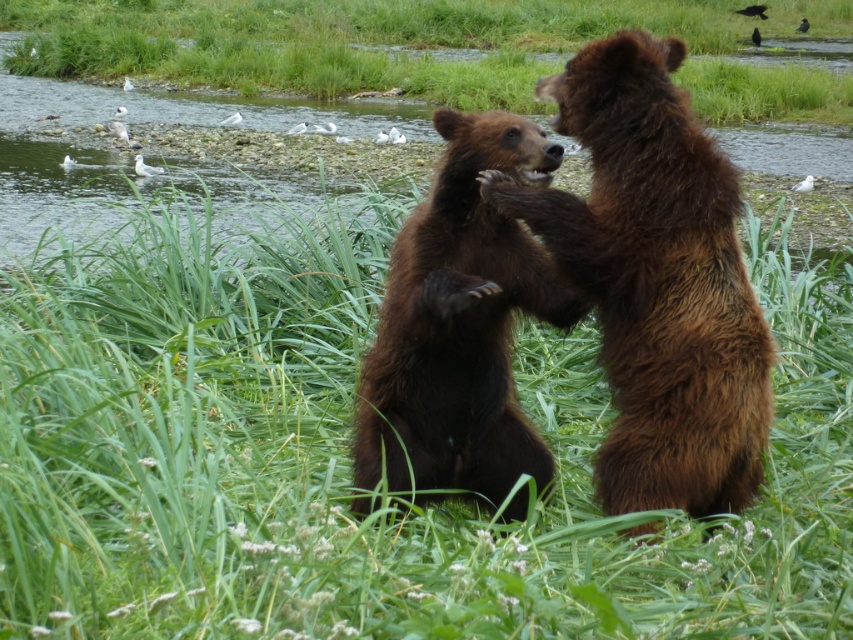
This screenshot has height=640, width=853. What do you see at coordinates (656, 280) in the screenshot? I see `brown fuzzy bear at center` at bounding box center [656, 280].

Does brown fuzzy bear at center lie in front of brown furry bear at center?

No, brown fuzzy bear at center is behind brown furry bear at center.

Which is behind, point (699, 198) or point (374, 424)?

The point (374, 424) is more distant.

You are a GUI agent. You are given a task and a screenshot of the screen. Output one action in this format:
    pyautogui.click(x=<x>, y=<y>)
    Task: Click on the brown fuzzy bear at center
    The height and width of the screenshot is (640, 853).
    Given the screenshot: What is the action you would take?
    pyautogui.click(x=656, y=280)

Who is positioned more to the left, green grassy at center or brown fuzzy bear at center?

green grassy at center is more to the left.

Between point (39, 412) and point (766, 394), which one is positioned behind?

The point (39, 412) is more distant.

Which is in front, point (78, 268) or point (608, 342)?

Point (608, 342)

At what (x,y) coordinates should I click in order to perform the action: click on green grassy at center. Please return your answer as a coordinate pair (x, y). Image resolution: width=853 pixels, height=640 pixels. Looking at the image, I should click on (350, 460).

Does point (566, 333) come behind point (537, 164)?

Yes, point (566, 333) is behind point (537, 164).

Does point (383, 541) lie in front of point (438, 397)?

Yes, point (383, 541) is closer to viewer.

What are the coordinates of `green grassy at center` in the screenshot? It's located at (350, 460).